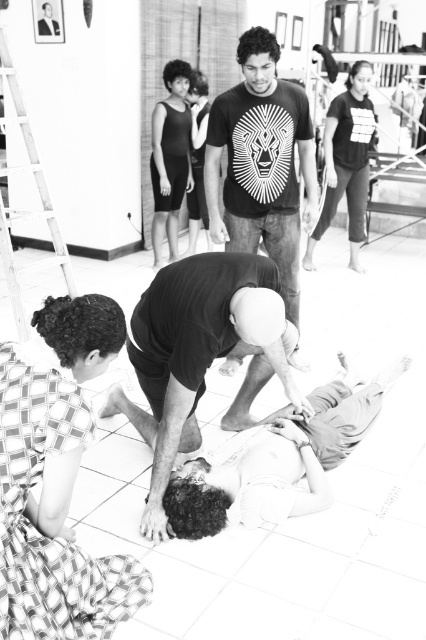
Question: Which object is farther from the camera taking this photo?

Choices:
 (A) metallic white ladder at upper left
 (B) checkered fabric at lower left

Answer: (A)

Question: Is black matte shirt at center wider than metallic white ladder at upper left?

Choices:
 (A) yes
 (B) no

Answer: (A)

Question: Which of the following is the closest to the observer?

Choices:
 (A) matte black dress at upper left
 (B) checkered fabric at lower left

Answer: (B)

Question: Does checkered fabric at lower left have a smaller size compared to matte black shirt at upper center?

Choices:
 (A) no
 (B) yes

Answer: (B)

Question: Is black matte shirt at center above smooth skin person at lower center?

Choices:
 (A) no
 (B) yes

Answer: (B)

Question: Which of the following is the closest to the observer?

Choices:
 (A) matte black shirt at upper center
 (B) checkered fabric at lower left

Answer: (B)